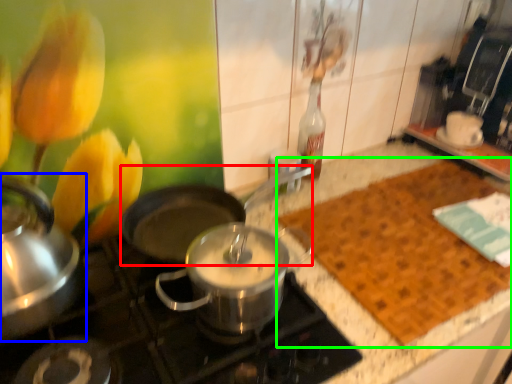
Question: Considering the real-world distances, which object is farthest from wok (highlighted by a red box)? kitchen appliance (highlighted by a blue box) or mat (highlighted by a green box)?

Choices:
 (A) kitchen appliance
 (B) mat

Answer: (B)